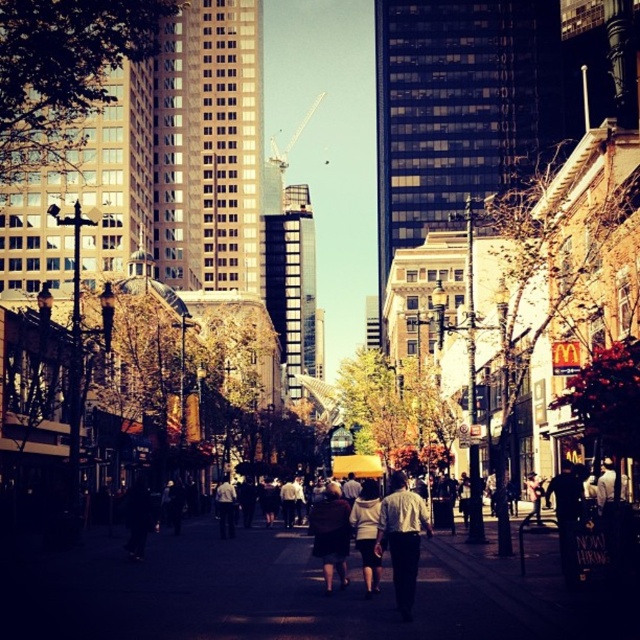
Question: Does dark gray concrete sidewalk at center appear over dark brown leather jacket at center?

Choices:
 (A) yes
 (B) no

Answer: (B)

Question: Does dark gray concrete sidewalk at center appear over dark brown leather jacket at center?

Choices:
 (A) yes
 (B) no

Answer: (B)

Question: Which object appears farthest from the camera in this image?

Choices:
 (A) dark gray concrete sidewalk at center
 (B) light brown leather jacket at center

Answer: (B)

Question: Which object is positioned farthest from the dark brown leather jacket at center?

Choices:
 (A) dark gray concrete sidewalk at center
 (B) light brown leather jacket at center

Answer: (A)

Question: Which of these objects is positioned farthest from the light brown leather jacket at center?

Choices:
 (A) dark gray concrete sidewalk at center
 (B) dark brown leather jacket at center

Answer: (A)

Question: From the image, what is the correct spatial relationship of dark gray concrete sidewalk at center in relation to dark brown leather jacket at center?

Choices:
 (A) below
 (B) above

Answer: (A)